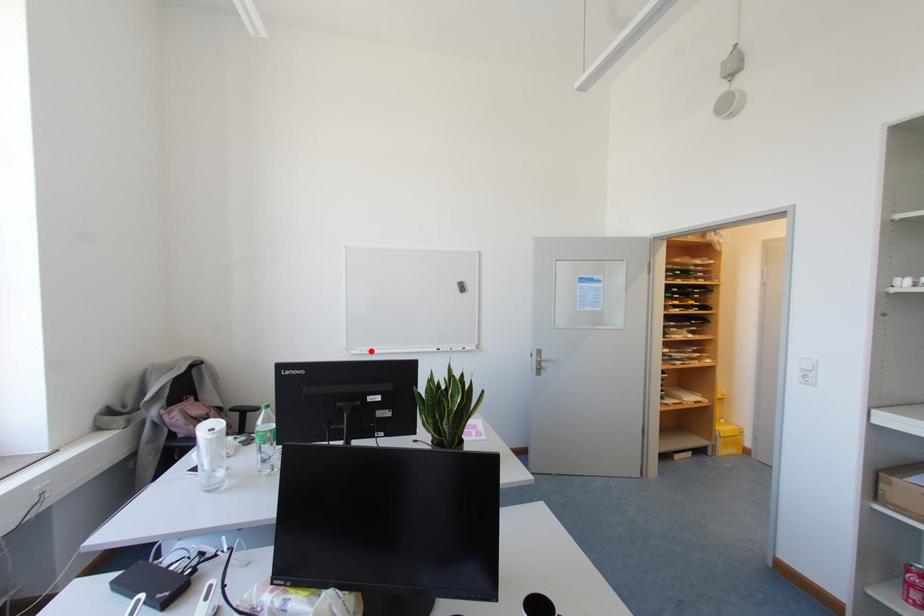
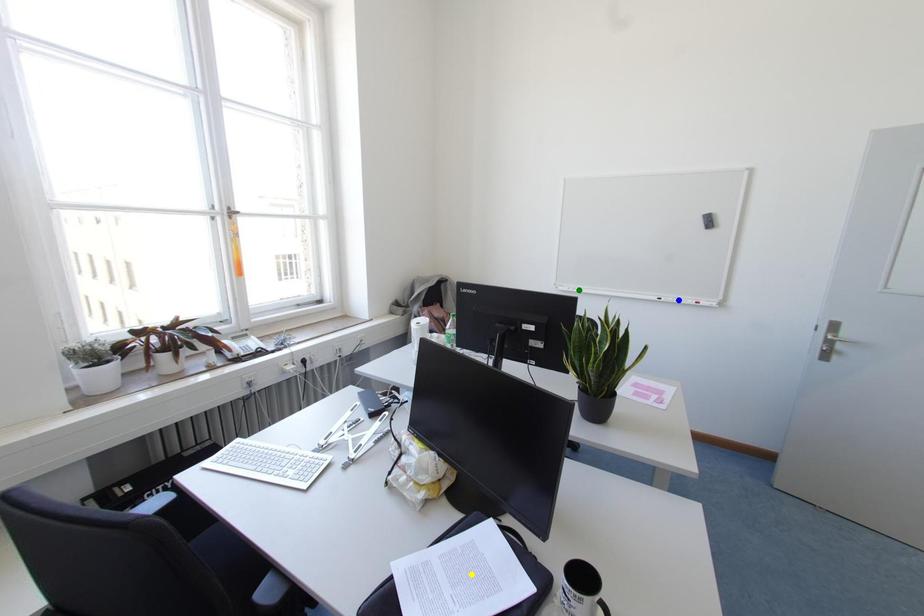
Question: I am providing you with two images of the same scene from different viewpoints. A red point is marked on the first image. You are given multiple points on the second image. Which spot in image 2 lines up with the point in image 1?

Choices:
 (A) blue point
 (B) yellow point
 (C) green point

Answer: (C)